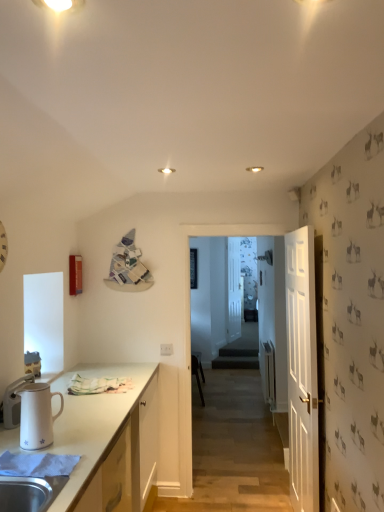
Question: Considering the positions of point (238, 314) and point (139, 379), is point (238, 314) closer or farther from the camera than point (139, 379)?

Choices:
 (A) farther
 (B) closer

Answer: (A)

Question: Considering their positions, is transparent glass door at center located in front of or behind white matte cabinet at lower left?

Choices:
 (A) behind
 (B) front

Answer: (A)

Question: Which object is positioned closest to the white matte clock at left?

Choices:
 (A) white wooden door at right
 (B) black plastic chair at center
 (C) white plastic electric outlet at center
 (D) white glossy pitcher at left
 (E) white matte cabinet at lower left

Answer: (D)

Question: Which object is positioned closest to the white wooden door at right?

Choices:
 (A) white matte cabinet at lower left
 (B) transparent glass door at center
 (C) white matte clock at left
 (D) white plastic electric outlet at center
 (E) white glossy pitcher at left

Answer: (D)